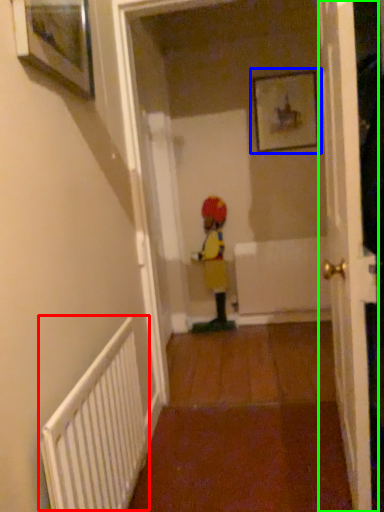
Question: Considering the real-world distances, which object is closest to radiator (highlighted by a red box)? picture frame (highlighted by a blue box) or door (highlighted by a green box).

Choices:
 (A) picture frame
 (B) door

Answer: (B)